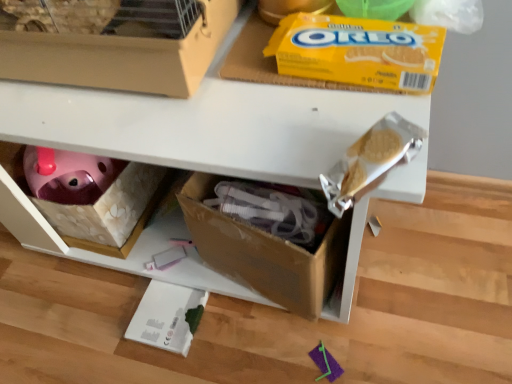
Question: Is cardboard box at lower center to the left of matte cardboard box at upper left from the viewer's perspective?

Choices:
 (A) yes
 (B) no

Answer: (B)

Question: Would you say cardboard box at lower center is outside matte cardboard box at upper left?

Choices:
 (A) yes
 (B) no

Answer: (A)

Question: Does cardboard box at lower center have a greater height compared to matte cardboard box at upper left?

Choices:
 (A) yes
 (B) no

Answer: (A)

Question: Does cardboard box at lower center lie behind matte cardboard box at upper left?

Choices:
 (A) no
 (B) yes

Answer: (B)

Question: Is cardboard box at lower center thinner than matte cardboard box at upper left?

Choices:
 (A) yes
 (B) no

Answer: (B)

Question: Are cardboard box at lower center and matte cardboard box at upper left located far from each other?

Choices:
 (A) yes
 (B) no

Answer: (B)

Question: Is yellow cardboard oreo at upper center touching matte cardboard box at upper left?

Choices:
 (A) no
 (B) yes

Answer: (A)

Question: Is yellow cardboard oreo at upper center not inside matte cardboard box at upper left?

Choices:
 (A) no
 (B) yes

Answer: (B)

Question: From the image's perspective, is yellow cardboard oreo at upper center located above matte cardboard box at upper left?

Choices:
 (A) yes
 (B) no

Answer: (B)

Question: Does yellow cardboard oreo at upper center appear on the left side of matte cardboard box at upper left?

Choices:
 (A) yes
 (B) no

Answer: (B)

Question: Considering the relative sizes of yellow cardboard oreo at upper center and matte cardboard box at upper left in the image provided, is yellow cardboard oreo at upper center smaller than matte cardboard box at upper left?

Choices:
 (A) no
 (B) yes

Answer: (B)

Question: From a real-world perspective, is yellow cardboard oreo at upper center located higher than matte cardboard box at upper left?

Choices:
 (A) no
 (B) yes

Answer: (A)

Question: Can you confirm if matte cardboard box at upper left is positioned to the left of yellow cardboard oreo at upper center?

Choices:
 (A) no
 (B) yes

Answer: (B)